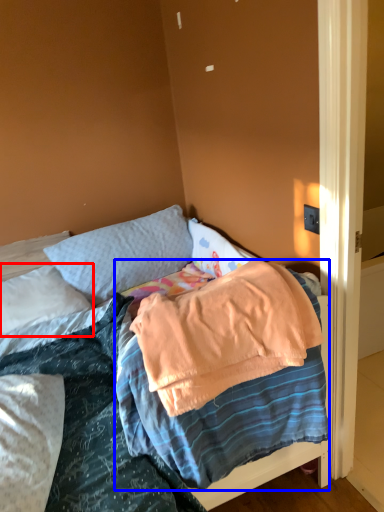
Question: Which of the following is the closest to the observer, pillow (highlighted by a red box) or blanket (highlighted by a blue box)?

Choices:
 (A) pillow
 (B) blanket

Answer: (B)